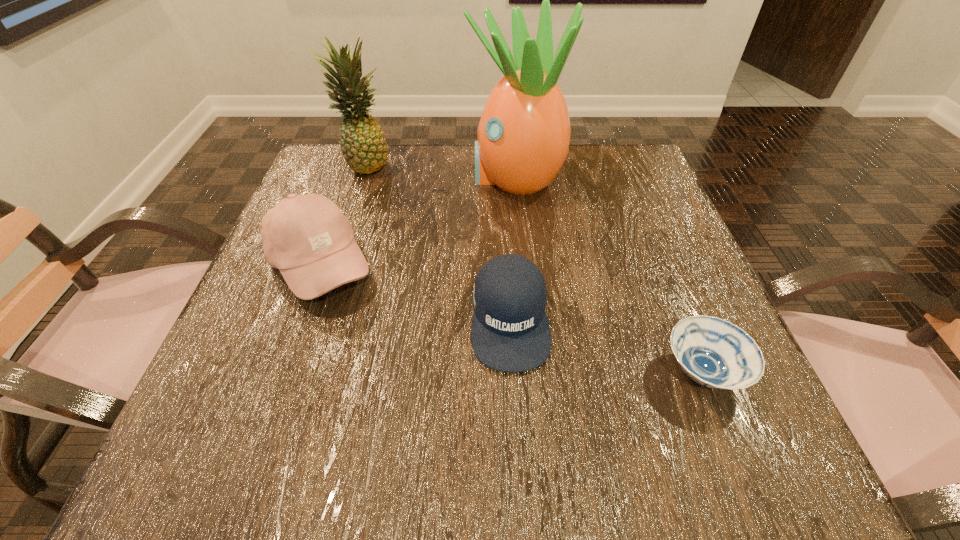
You are a GUI agent. You are given a task and a screenshot of the screen. Output one action in this format:
    pyautogui.click(x=<x>, y=<y>)
    Task: Click on the object positioned at the far left corner
    
    Given the screenshot: What is the action you would take?
    [x=362, y=141]

In the image, there is a desktop. In order to click on vacant region at the far edge in this screenshot , I will do `click(566, 176)`.

The height and width of the screenshot is (540, 960). In the image, there is a desktop. What are the coordinates of `vacant space at the near edge` in the screenshot? It's located at (506, 432).

This screenshot has height=540, width=960. In the image, there is a desktop. In order to click on vacant space at the left edge in this screenshot , I will do `click(257, 406)`.

Locate an element on the screen. This screenshot has width=960, height=540. free space at the right edge is located at coordinates (658, 344).

In the image, there is a desktop. Identify the location of vacant space at the far left corner. The width and height of the screenshot is (960, 540). (355, 181).

You are a GUI agent. You are given a task and a screenshot of the screen. Output one action in this format:
    pyautogui.click(x=<x>, y=<y>)
    Task: Click on the unoccupied position between the right pineapple and the third shortest object
    The width and height of the screenshot is (960, 540).
    Given the screenshot: What is the action you would take?
    pyautogui.click(x=418, y=221)

Where is `vacant area that lies between the taller baseball cap and the tallest object`? vacant area that lies between the taller baseball cap and the tallest object is located at coordinates (418, 221).

Image resolution: width=960 pixels, height=540 pixels. Identify the location of vacant point located between the rightmost object and the fourth tallest object. (606, 345).

The image size is (960, 540). I want to click on vacant area between the second shortest object and the fourth shortest object, so click(x=438, y=241).